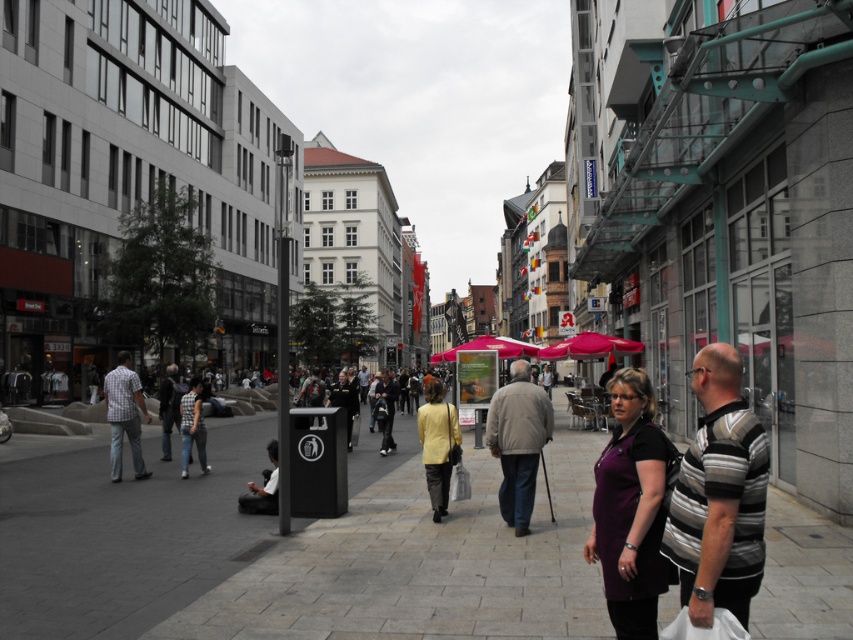
You are standing on the pedestrian area and want to take a photo of both the point at coordinates (138, 392) and the point at coordinates (183, 426). Which point should you focus on first to ensure both are in clear view?

You should focus on the point at coordinates (138, 392) first because it is closer to the camera than the point at coordinates (183, 426). This ensures both points are in clear view as the closer point will be in focus and the farther one will still be within the depth of field.

You are a photographer trying to capture both the dark gray jacket at center and the dark blue uniform at center in a single frame. Which object should you focus on first to ensure both are in the frame?

You should focus on the dark gray jacket at center first because it is taller than the dark blue uniform at center, so centering on the taller object will help include both in the frame.

You are a fashion designer observing the pedestrians on this busy street. You notice a person wearing light gray cotton pants at center and a striped shirt at center. Which clothing item has a greater horizontal dimension?

The light gray cotton pants at center has a greater horizontal dimension than the striped shirt at center, as its width surpasses the striped shirt at center.